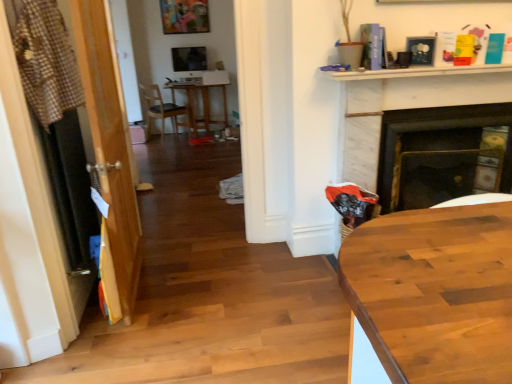
Find the location of a particular element. This screenshot has width=512, height=384. empty space that is to the right of wooden door at left is located at coordinates (201, 291).